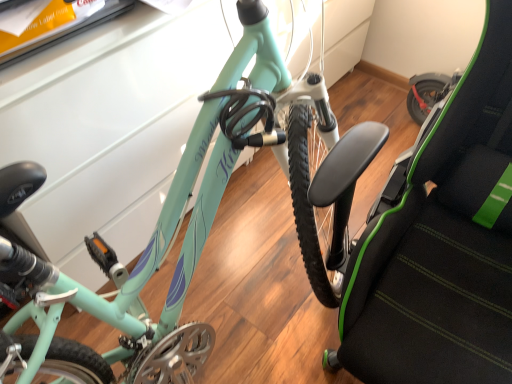
Identify the location of black fabric swivel chair at right. (441, 242).

What is the approximate height of black fabric swivel chair at right?

black fabric swivel chair at right is 3.42 feet in height.

What do you see at coordinates (441, 242) in the screenshot?
I see `black fabric swivel chair at right` at bounding box center [441, 242].

The width and height of the screenshot is (512, 384). In order to click on black fabric swivel chair at right in this screenshot , I will do `click(441, 242)`.